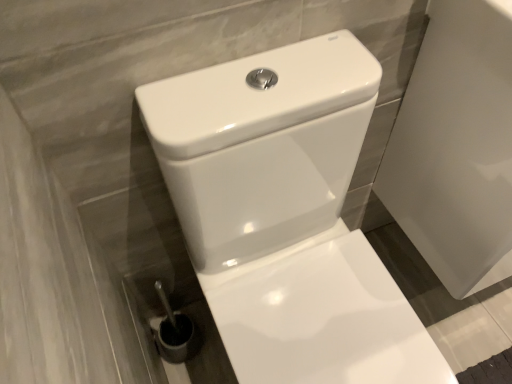
Question: Which is correct: white glossy porcelain at right is inside white glossy toilet at center, or outside of it?

Choices:
 (A) outside
 (B) inside

Answer: (A)

Question: Would you say white glossy porcelain at right is to the left or to the right of white glossy toilet at center in the picture?

Choices:
 (A) left
 (B) right

Answer: (B)

Question: Considering the positions of white glossy porcelain at right and white glossy toilet at center in the image, is white glossy porcelain at right taller or shorter than white glossy toilet at center?

Choices:
 (A) short
 (B) tall

Answer: (A)

Question: Considering the positions of point (323, 183) and point (415, 66), is point (323, 183) closer or farther from the camera than point (415, 66)?

Choices:
 (A) closer
 (B) farther

Answer: (A)

Question: Considering the positions of white glossy toilet at center and white glossy porcelain at right in the image, is white glossy toilet at center bigger or smaller than white glossy porcelain at right?

Choices:
 (A) big
 (B) small

Answer: (A)

Question: In the image, is white glossy toilet at center on the left side or the right side of white glossy porcelain at right?

Choices:
 (A) left
 (B) right

Answer: (A)

Question: From a real-world perspective, is white glossy toilet at center above or below white glossy porcelain at right?

Choices:
 (A) below
 (B) above

Answer: (A)